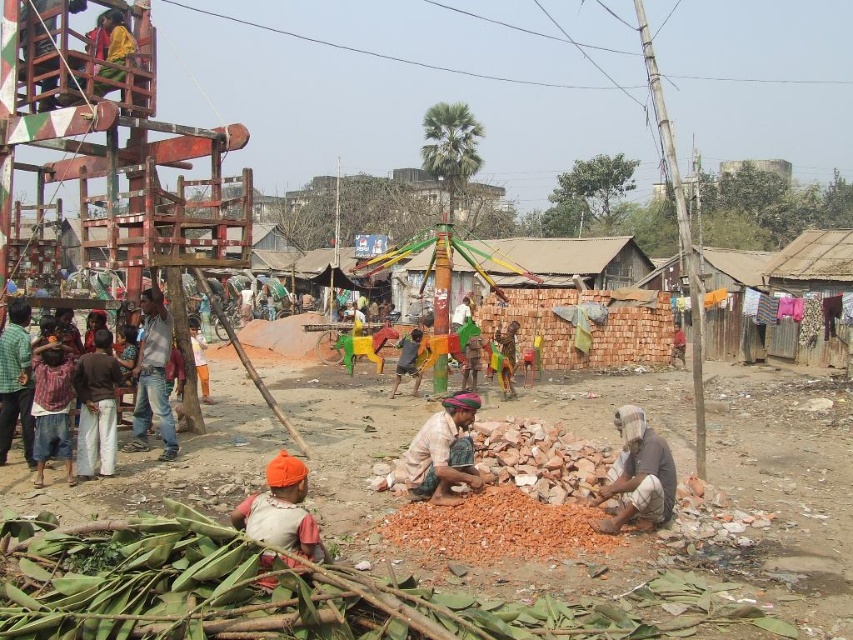
You are observing two workers in the scene. One is wearing a brown cotton shirt at left and the other a plaid shirt at left. From your perspective, which worker is positioned more to the right?

The brown cotton shirt at left is positioned more to the right than the plaid shirt at left.

You are a photographer trying to capture a candid shot of both the jeans at center and the green checkered shirt at left without them noticing. Your camera has a maximum focus range of 1.5 meters. Can you fit both subjects within the focus range?

The jeans at center and green checkered shirt at left are 1.41 meters apart, so yes, the photographer can fit both subjects within the focus range since the distance between them is less than the camera maximum focus range of 1.5 meters.